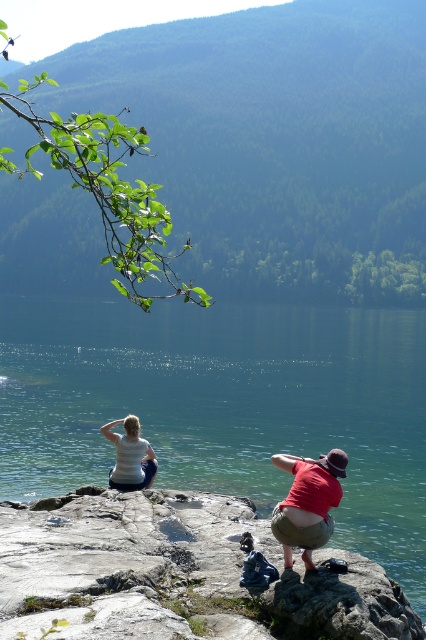
What is the location of the point with coordinates (226, 404) in the image?

The point with coordinates (226, 404) is located on the green stone lake at center.

You are a photographer trying to capture the entire scene of the green stone lake at center and the white cotton shirt at center in one shot. Given their sizes, which object should you focus on to ensure both are clearly visible in the frame?

The green stone lake at center is larger in size than the white cotton shirt at center, so you should focus on the green stone lake at center to ensure both objects are clearly visible in the frame.

You are a photographer trying to capture a portrait of the person wearing the white cotton shirt at center. Given that the camera you are using has a focal length of 50mm and you want to ensure the shirt is in the center of the frame, where should you position the camera relative to the shirt?

To center the white cotton shirt at center in the frame, position the camera directly in front of the shirt at the coordinates corresponding to point (307, 502), ensuring the lens is aligned with this point for optimal framing.